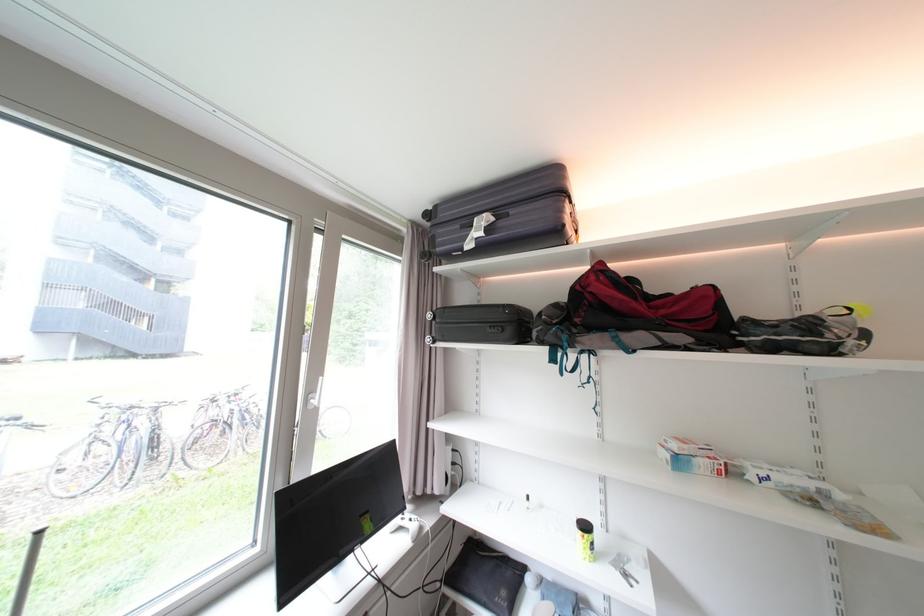
This screenshot has width=924, height=616. What do you see at coordinates (690, 456) in the screenshot?
I see `a small cardboard box` at bounding box center [690, 456].